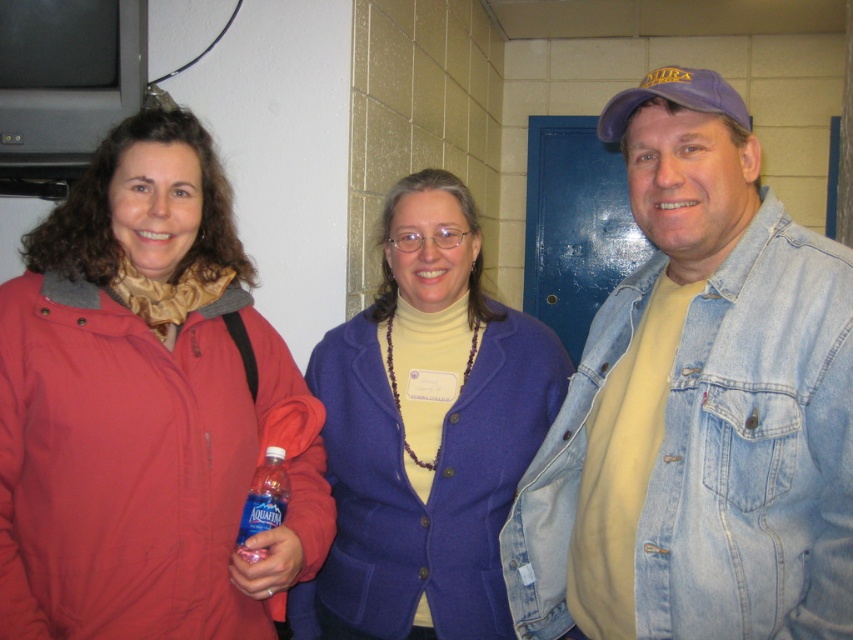
You are organizing a clothing donation drive and need to pack these items into boxes. The denim jacket at right and the matte red jacket at left must be placed in separate boxes. Given their sizes, which jacket will require a larger box?

The matte red jacket at left requires a larger box because it occupies more space than the denim jacket at right.

You are standing at the entrance of the room and want to move towards the denim jacket at right. Given that the entrance is near the blue door in the background, can you estimate the direction you should walk to reach it?

The denim jacket at right is located at point 0.637 on the x and 0.818 on the y axis. Since the entrance is near the blue door, you should walk towards the right side of the room to reach the denim jacket at right.

You are a delivery person who needs to place a package between the denim jacket at right and the clear plastic bottle at center. The package is 18 inches long. Can you fit it between them without moving either object?

The denim jacket at right and clear plastic bottle at center are 20.60 inches apart. Since the package is 18 inches long, it can fit between them as the space is slightly larger than the package.